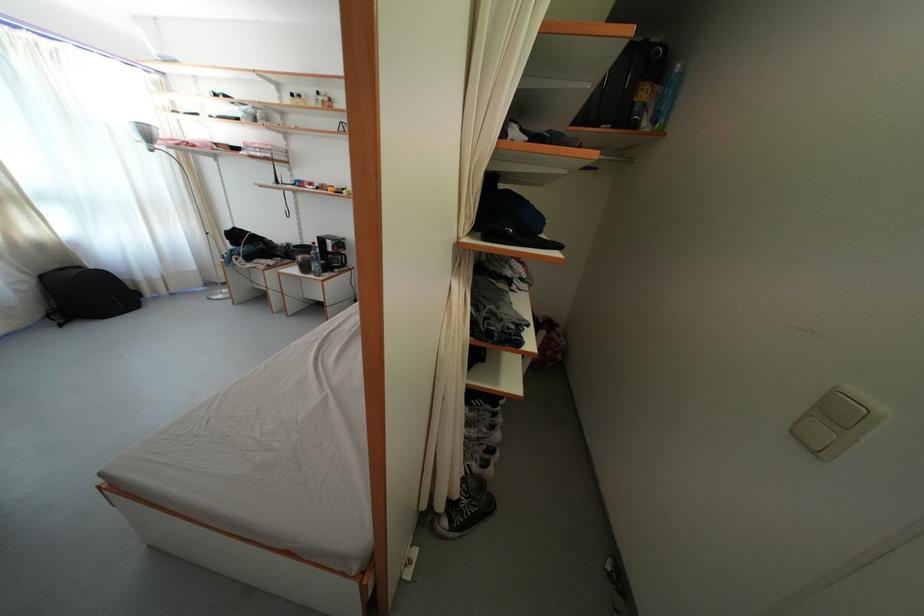
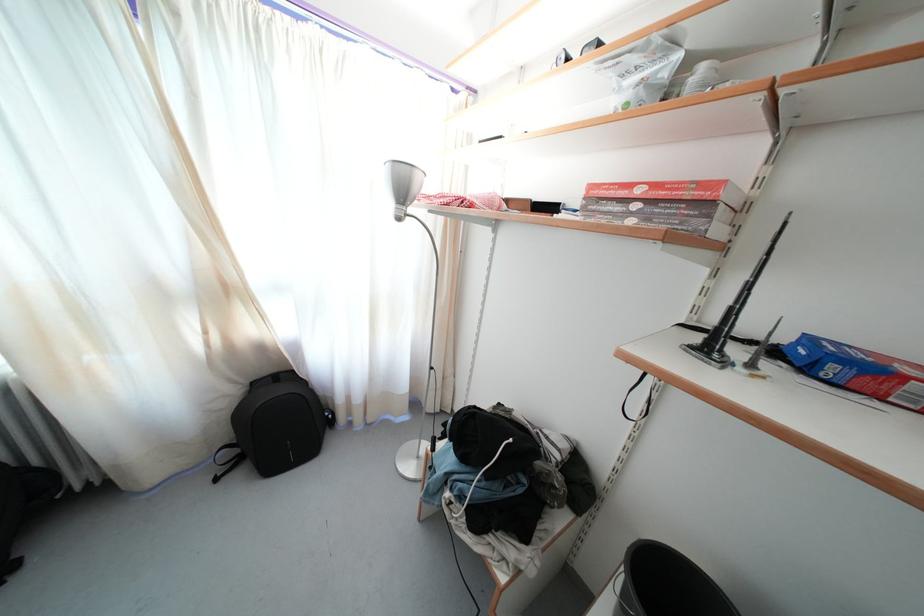
In the second image, find the point that corresponds to pixel 49 283 in the first image.

(259, 390)